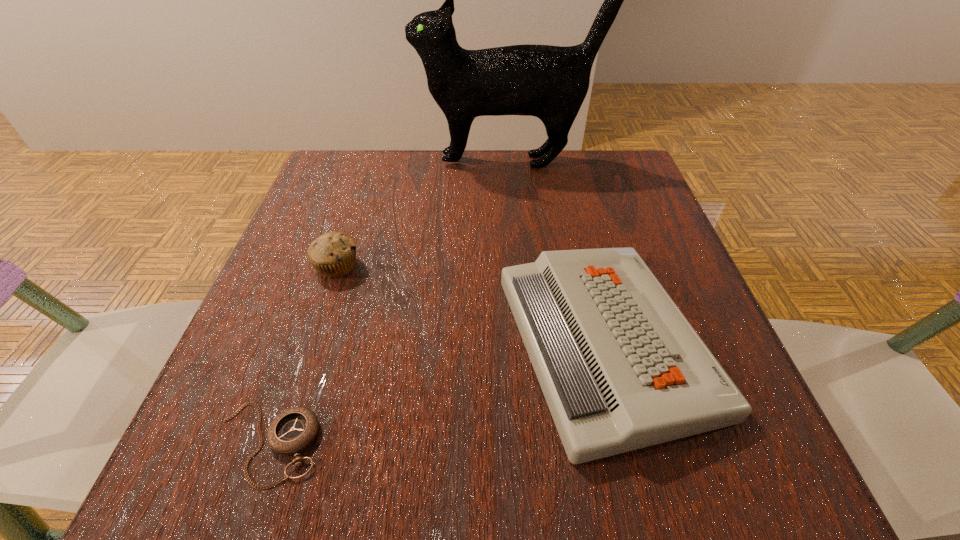
Where is `unoccupied position between the computer keyboard and the pocket watch`? The height and width of the screenshot is (540, 960). unoccupied position between the computer keyboard and the pocket watch is located at coordinates (437, 393).

Locate an element on the screen. free space between the tallest object and the muffin is located at coordinates (424, 214).

I want to click on vacant region between the muffin and the cat, so click(x=424, y=214).

At what (x,y) coordinates should I click in order to perform the action: click on free space between the muffin and the tallest object. Please return your answer as a coordinate pair (x, y). The height and width of the screenshot is (540, 960). Looking at the image, I should click on (424, 214).

At what (x,y) coordinates should I click in order to perform the action: click on empty space that is in between the pocket watch and the muffin. Please return your answer as a coordinate pair (x, y). Image resolution: width=960 pixels, height=540 pixels. Looking at the image, I should click on (302, 355).

Locate an element on the screen. This screenshot has height=540, width=960. object that stands as the second closest to the pocket watch is located at coordinates (621, 368).

Choose which object is the second nearest neighbor to the computer keyboard. Please provide its 2D coordinates. Your answer should be formatted as a tuple, i.e. [(x, y)], where the tuple contains the x and y coordinates of a point satisfying the conditions above.

[(333, 254)]

Find the location of a particular element. vacant area that satisfies the following two spatial constraints: 1. on the face of the computer keyboard; 2. on the right side of the tallest object is located at coordinates (528, 343).

Identify the location of vacant position in the image that satisfies the following two spatial constraints: 1. on the face of the computer keyboard; 2. on the left side of the tallest object. This screenshot has width=960, height=540. (528, 343).

The width and height of the screenshot is (960, 540). Find the location of `vacant space that satisfies the following two spatial constraints: 1. on the back side of the computer keyboard; 2. on the right side of the pocket watch`. vacant space that satisfies the following two spatial constraints: 1. on the back side of the computer keyboard; 2. on the right side of the pocket watch is located at coordinates (302, 343).